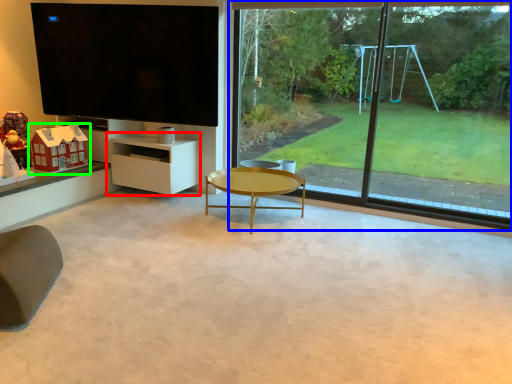
Question: Estimate the real-world distances between objects in this image. Which object is closer to shelf (highlighted by a red box), window (highlighted by a blue box) or toy (highlighted by a green box)?

Choices:
 (A) window
 (B) toy

Answer: (B)